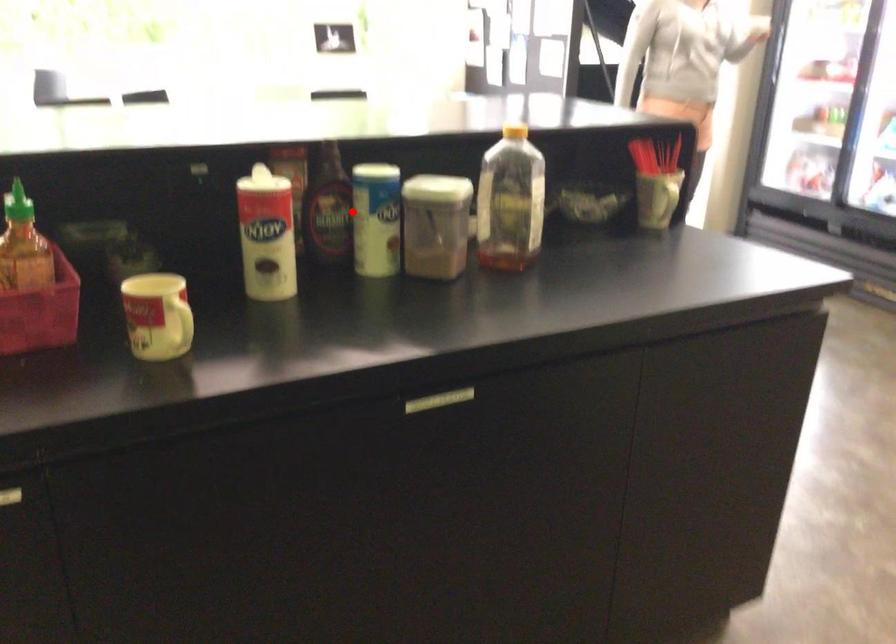
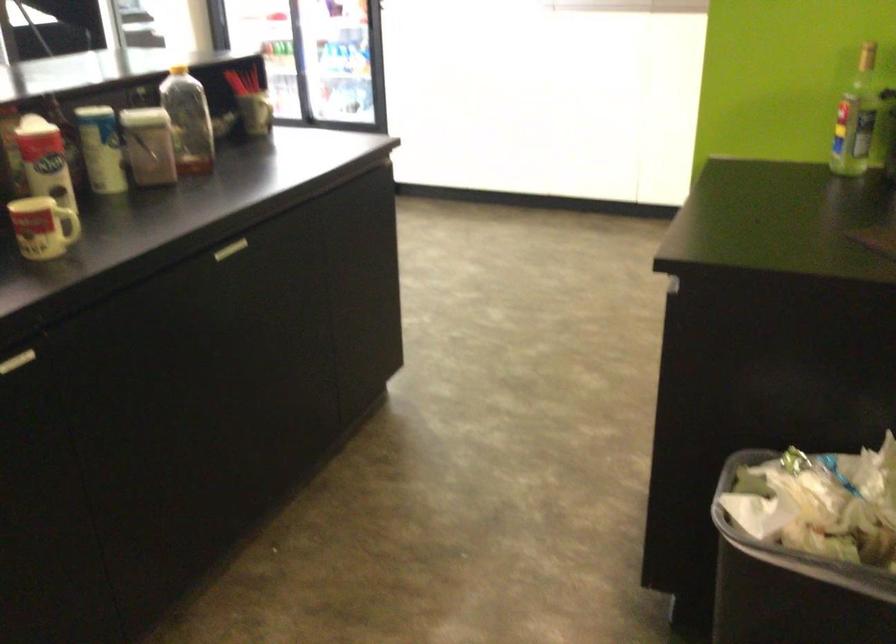
Find the pixel in the second image that matches the highlighted location in the first image.

(100, 149)